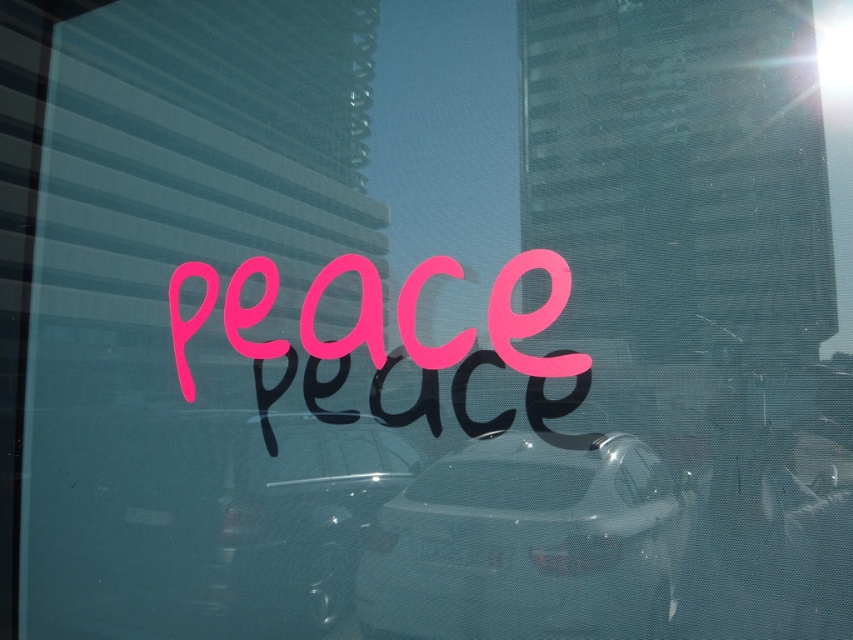
Who is higher up, satin silver car at center or metallic silver car at center?

metallic silver car at center

In the scene shown: Is satin silver car at center above metallic silver car at center?

Incorrect, satin silver car at center is not positioned above metallic silver car at center.

What are the coordinates of `satin silver car at center` in the screenshot? It's located at (526, 545).

Measure the distance from satin silver car at center to pink matte text at center.

They are 25.89 centimeters apart.

Between satin silver car at center and pink matte text at center, which one has less height?

pink matte text at center

Find the location of a particular element. Image resolution: width=853 pixels, height=640 pixels. satin silver car at center is located at coordinates (526, 545).

Who is more forward, [322,488] or [376,352]?

Point [376,352] is more forward.

Is point (239, 605) less distant than point (552, 307)?

No, (239, 605) is behind (552, 307).

Who is more forward, (250, 538) or (453, 275)?

Point (453, 275)

Locate an element on the screen. metallic silver car at center is located at coordinates (299, 522).